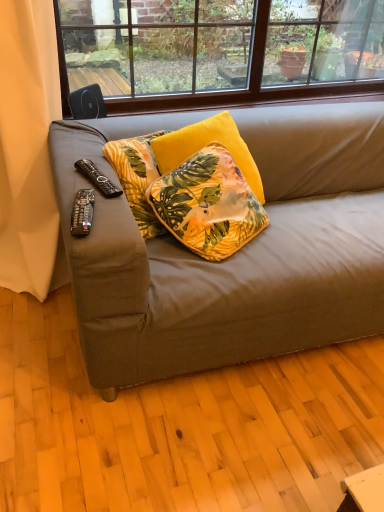
Question: From a real-world perspective, is beige fabric curtain at left below velvet floral pillow at center?

Choices:
 (A) yes
 (B) no

Answer: (B)

Question: Is beige fabric curtain at left wider than velvet floral pillow at center?

Choices:
 (A) no
 (B) yes

Answer: (B)

Question: Can you see beige fabric curtain at left touching velvet floral pillow at center?

Choices:
 (A) no
 (B) yes

Answer: (A)

Question: Would you say beige fabric curtain at left is outside velvet floral pillow at center?

Choices:
 (A) no
 (B) yes

Answer: (B)

Question: Is beige fabric curtain at left at the right side of velvet floral pillow at center?

Choices:
 (A) no
 (B) yes

Answer: (A)

Question: Is the depth of beige fabric curtain at left greater than that of velvet floral pillow at center?

Choices:
 (A) yes
 (B) no

Answer: (B)

Question: Can you confirm if beige fabric curtain at left is taller than black plastic remote at left, marked as the first remote control in a top-to-bottom arrangement?

Choices:
 (A) yes
 (B) no

Answer: (A)

Question: Is black plastic remote at left, placed as the second remote control when sorted from front to back, completely or partially inside beige fabric curtain at left?

Choices:
 (A) yes
 (B) no

Answer: (B)

Question: Can you confirm if beige fabric curtain at left is smaller than black plastic remote at left, marked as the first remote control in a top-to-bottom arrangement?

Choices:
 (A) no
 (B) yes

Answer: (A)

Question: From the image's perspective, would you say beige fabric curtain at left is shown under black plastic remote at left, which ranks as the first remote control in back-to-front order?

Choices:
 (A) yes
 (B) no

Answer: (B)

Question: From a real-world perspective, is beige fabric curtain at left on black plastic remote at left, marked as the first remote control in a top-to-bottom arrangement?

Choices:
 (A) no
 (B) yes

Answer: (A)

Question: Is beige fabric curtain at left beside black plastic remote at left, which ranks as the first remote control in back-to-front order?

Choices:
 (A) yes
 (B) no

Answer: (B)

Question: Is black plastic remote control at lower left, the second remote control viewed from the back, positioned with its back to beige fabric curtain at left?

Choices:
 (A) no
 (B) yes

Answer: (A)